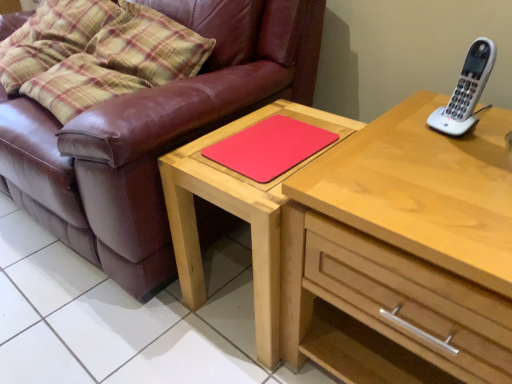
This screenshot has width=512, height=384. I want to click on vacant region in front of white plastic phone at upper right, so click(x=462, y=161).